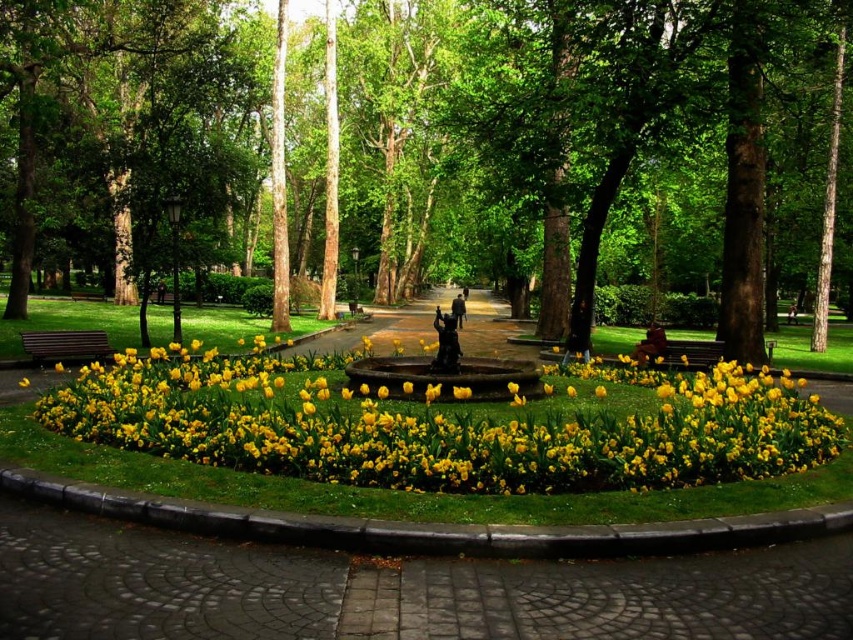
You are planning to place a small bench between the green leafy tree at center and the yellow matte flowers at center. Based on their sizes, which side of the bench should be closer to the tree to ensure there is enough space for both the tree and the flowers?

The green leafy tree at center might be wider than the yellow matte flowers at center, so to ensure enough space, the bench should be placed closer to the flowers to accommodate the tree.